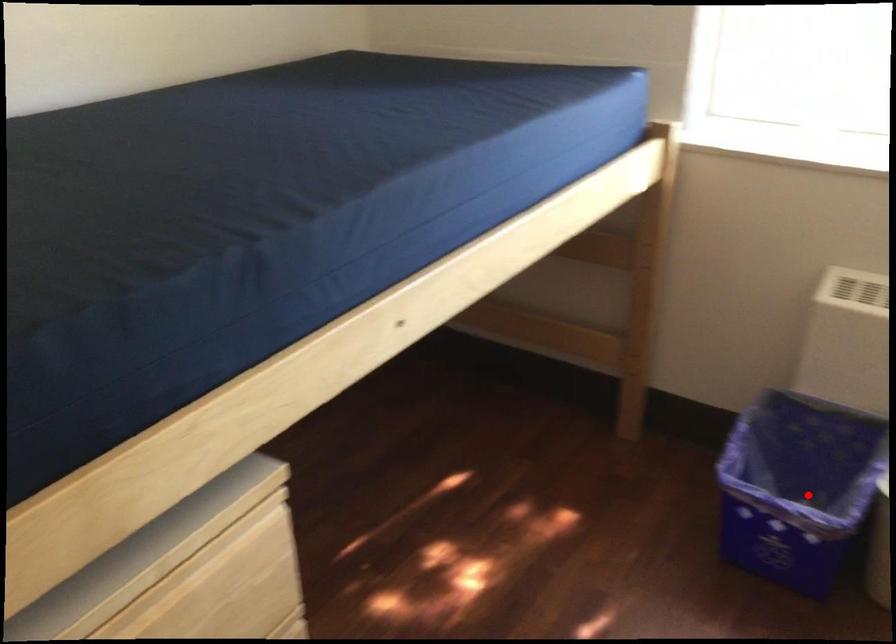
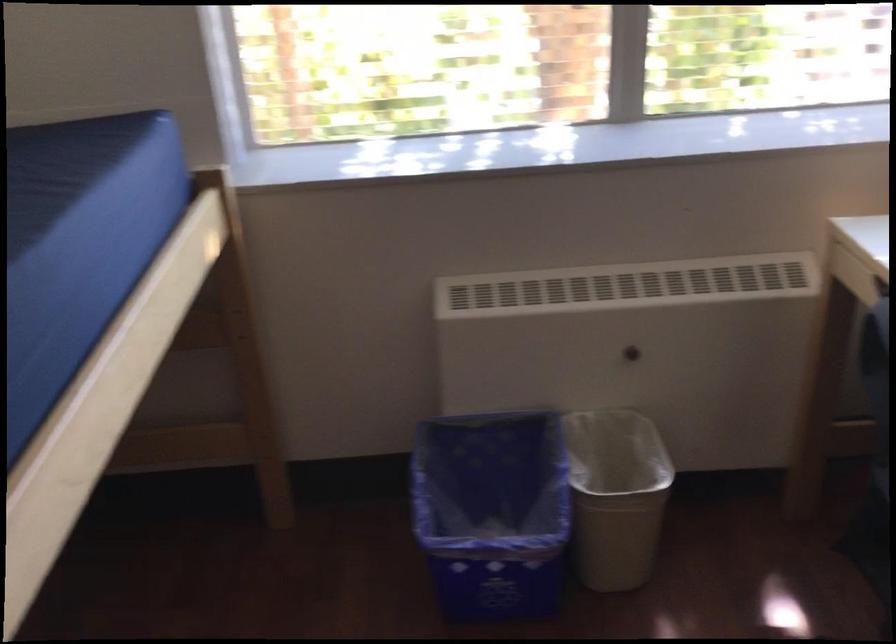
Question: I am providing you with two images of the same scene from different viewpoints. A red point is marked on the first image. Can you still see the location of the red point in image 2?

Choices:
 (A) Yes
 (B) No

Answer: (A)